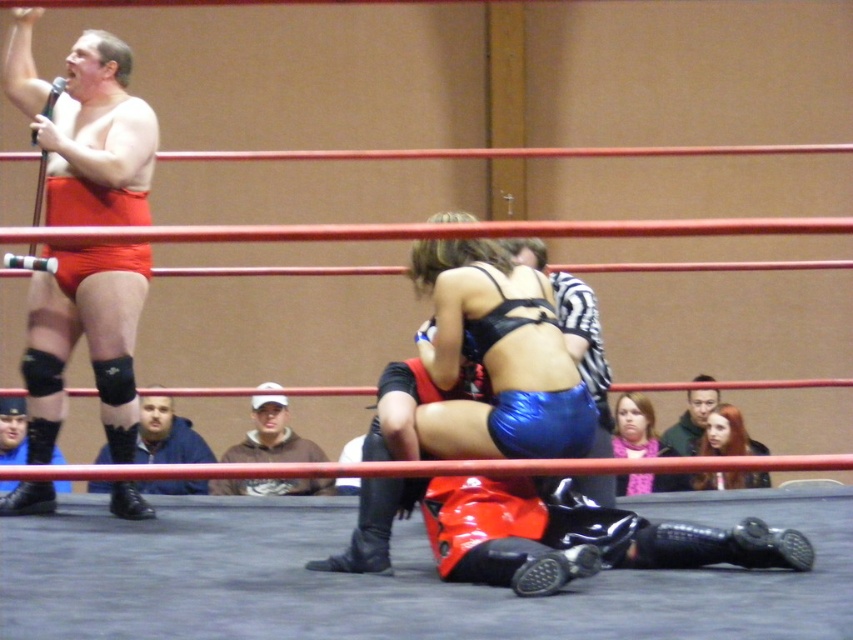
You are a photographer standing near the camera at the bottom of the image. You want to take a picture of the blue fabric jacket at lower left without moving the camera. Is the jacket within the camera lens range of 6 meters?

The blue fabric jacket at lower left and camera are 6.20 meters apart from each other, so the jacket is slightly out of the camera lens range of 6 meters.

You are a photographer standing at the edge of the wrestling ring. You need to capture a clear photo of both the shiny blue shorts at center and the matte black boots at lower left. Based on their positions, will the boots be visible in the photo if you focus on the shorts?

The shiny blue shorts at center is positioned over matte black boots at lower left, so if you focus on the shorts, the boots at lower left might be partially or fully obscured depending on the camera angle and zoom. However, since the shorts are directly over the boots, there is a high chance the boots will be at least partially visible unless the shorts completely cover them.

You are a photographer at the wrestling match and want to capture both the blue fabric jacket at lower left and the pink fleece scarf at upper center in the same frame. Which object should you focus on first to ensure both are in the frame?

You should focus on the blue fabric jacket at lower left first because it is wider than the pink fleece scarf at upper center, allowing more room to adjust the frame to include both.